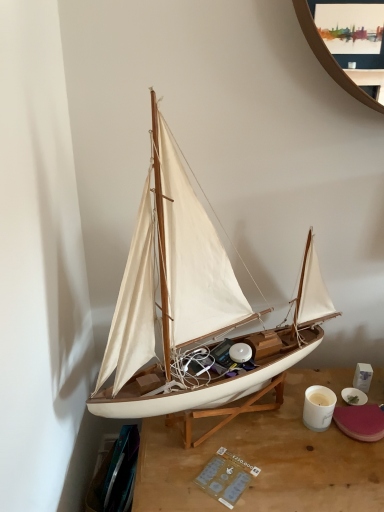
What do you see at coordinates (318, 407) in the screenshot?
I see `white glossy coffee cup at lower right` at bounding box center [318, 407].

Identify the location of white glossy coffee cup at lower right. Image resolution: width=384 pixels, height=512 pixels. (318, 407).

What do you see at coordinates (267, 459) in the screenshot? I see `wooden desk at center` at bounding box center [267, 459].

Where is `white matte sailboat at center`? This screenshot has height=512, width=384. white matte sailboat at center is located at coordinates (191, 300).

From a real-world perspective, is white glossy coffee cup at lower right located higher than white matte sailboat at center?

No.

From the image's perspective, is white glossy coffee cup at lower right above or below white matte sailboat at center?

From the image's perspective, white glossy coffee cup at lower right appears below white matte sailboat at center.

Is white glossy coffee cup at lower right smaller than white matte sailboat at center?

Indeed, white glossy coffee cup at lower right has a smaller size compared to white matte sailboat at center.

Measure the distance from white glossy coffee cup at lower right to white matte sailboat at center.

13.37 inches.

From a real-world perspective, is white glossy coffee cup at lower right located beneath wooden desk at center?

No, from a real-world perspective, white glossy coffee cup at lower right is not beneath wooden desk at center.

Is white glossy coffee cup at lower right aimed at wooden desk at center?

No, white glossy coffee cup at lower right is not aimed at wooden desk at center.

Find the location of `coffee cup on the right of wooden desk at center`. coffee cup on the right of wooden desk at center is located at coordinates (318, 407).

Is white glossy coffee cup at lower right bigger than wooden desk at center?

Incorrect, white glossy coffee cup at lower right is not larger than wooden desk at center.

Is white matte sailboat at center turned away from wooden desk at center?

No, white matte sailboat at center is not facing the opposite direction of wooden desk at center.

Is there a large distance between white matte sailboat at center and wooden desk at center?

white matte sailboat at center is near wooden desk at center, not far away.

Does white matte sailboat at center have a greater width compared to wooden desk at center?

No, white matte sailboat at center is not wider than wooden desk at center.

Is white matte sailboat at center smaller than wooden desk at center?

No.

From a real-world perspective, is wooden desk at center under white glossy coffee cup at lower right?

Yes, from a real-world perspective, wooden desk at center is under white glossy coffee cup at lower right.

From the image's perspective, is wooden desk at center above or below white glossy coffee cup at lower right?

wooden desk at center is below white glossy coffee cup at lower right.

Between wooden desk at center and white glossy coffee cup at lower right, which one is positioned behind?

Positioned behind is white glossy coffee cup at lower right.

How many degrees apart are the facing directions of wooden desk at center and white glossy coffee cup at lower right?

The angle between the facing direction of wooden desk at center and the facing direction of white glossy coffee cup at lower right is 8.4 degrees.

From a real-world perspective, between white matte sailboat at center and white glossy coffee cup at lower right, who is vertically lower?

white glossy coffee cup at lower right is physically lower.

Does white matte sailboat at center appear on the right side of white glossy coffee cup at lower right?

No.

Is white matte sailboat at center facing towards white glossy coffee cup at lower right?

No, white matte sailboat at center is not aimed at white glossy coffee cup at lower right.

Considering the points (376, 444) and (288, 357), which point is in front, point (376, 444) or point (288, 357)?

The point (376, 444) is more forward.

How much distance is there between wooden desk at center and white matte sailboat at center?

The distance of wooden desk at center from white matte sailboat at center is 24.09 centimeters.

From a real-world perspective, is wooden desk at center on white matte sailboat at center?

No, from a real-world perspective, wooden desk at center is not on top of white matte sailboat at center.

Relative to white matte sailboat at center, is wooden desk at center in front or behind?

wooden desk at center is positioned farther from the viewer than white matte sailboat at center.

This screenshot has width=384, height=512. I want to click on boat above the white glossy coffee cup at lower right (from the image's perspective), so click(191, 300).

What are the coordinates of `coffee cup above the wooden desk at center (from a real-world perspective)` in the screenshot? It's located at (318, 407).

Which object lies nearer to the anchor point white glossy coffee cup at lower right, wooden desk at center or white matte sailboat at center?

Among the two, wooden desk at center is located nearer to white glossy coffee cup at lower right.

In the scene shown: From the image, which object appears to be farther from white matte sailboat at center, wooden desk at center or white glossy coffee cup at lower right?

white glossy coffee cup at lower right is further to white matte sailboat at center.

From the picture: Which object lies further to the anchor point white matte sailboat at center, white glossy coffee cup at lower right or wooden desk at center?

Based on the image, white glossy coffee cup at lower right appears to be further to white matte sailboat at center.

From the image, which object appears to be farther from wooden desk at center, white glossy coffee cup at lower right or white matte sailboat at center?

The object further to wooden desk at center is white matte sailboat at center.

Considering their positions, is white matte sailboat at center positioned closer to wooden desk at center than white glossy coffee cup at lower right?

white glossy coffee cup at lower right is positioned closer to the anchor wooden desk at center.

Considering their positions, is white matte sailboat at center positioned further to white glossy coffee cup at lower right than wooden desk at center?

The object further to white glossy coffee cup at lower right is white matte sailboat at center.

Find the location of a particular element. The height and width of the screenshot is (512, 384). coffee cup between white matte sailboat at center and wooden desk at center from top to bottom is located at coordinates (318, 407).